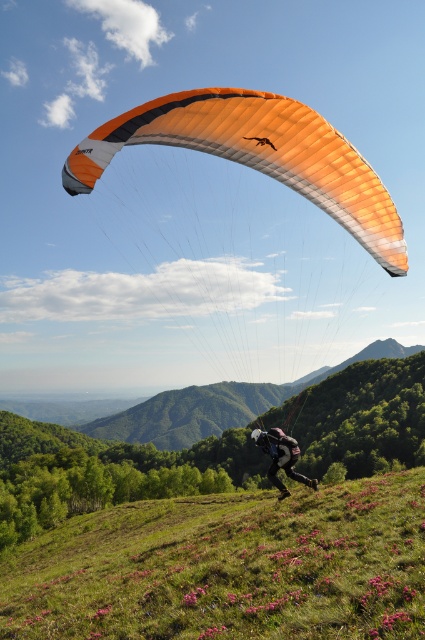
You are a photographer trying to capture the paraglider setup. You need to know if the orange fabric parachute at upper center is above or below the black fabric parachute at center to frame your shot. Which is it?

The orange fabric parachute at upper center is positioned under the black fabric parachute at center, so it is below it.

You are a pilot who needs to land on a target area located at point 0.244, 0.607. You see the orange fabric parachute at upper center. Where should you aim your landing?

You should aim for the orange fabric parachute at upper center because it is located exactly at the target point (257, 156).